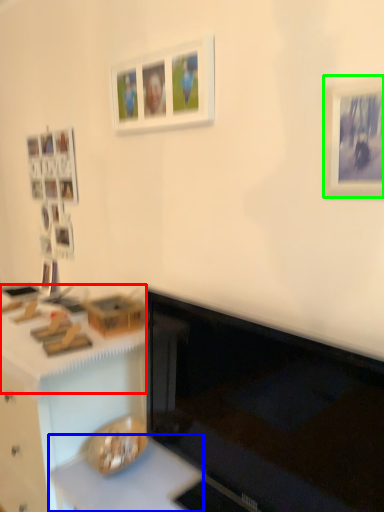
Question: Based on their relative distances, which object is nearer to counter top (highlighted by a red box)? Choose from counter top (highlighted by a blue box) and picture frame (highlighted by a green box).

Choices:
 (A) counter top
 (B) picture frame

Answer: (A)